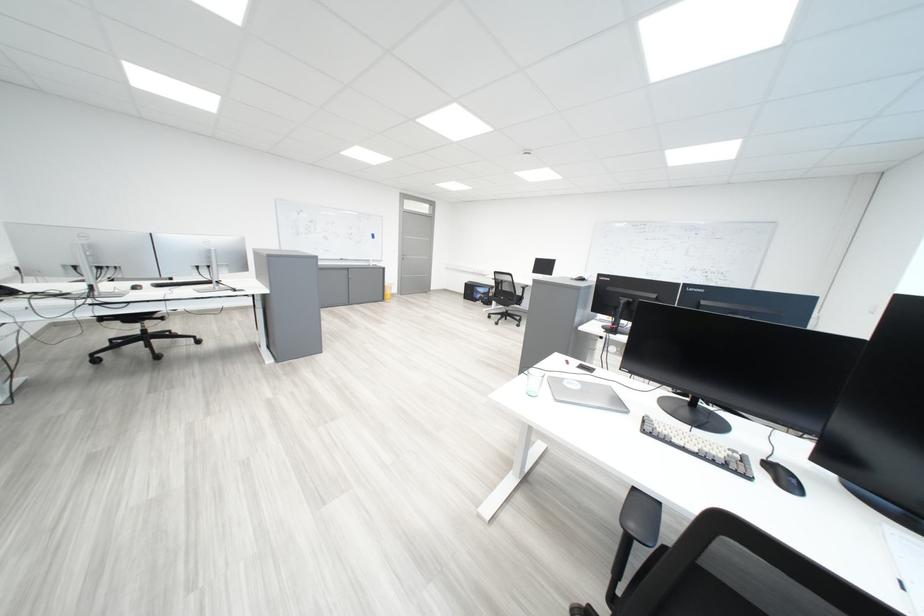
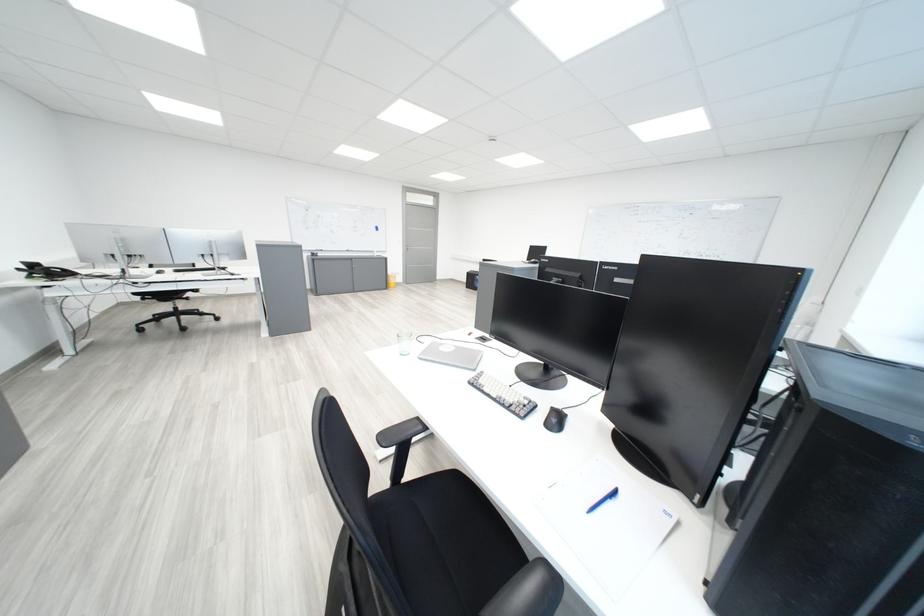
Find the pixel in the second image that matches (x=793, y=485) in the first image.

(562, 426)